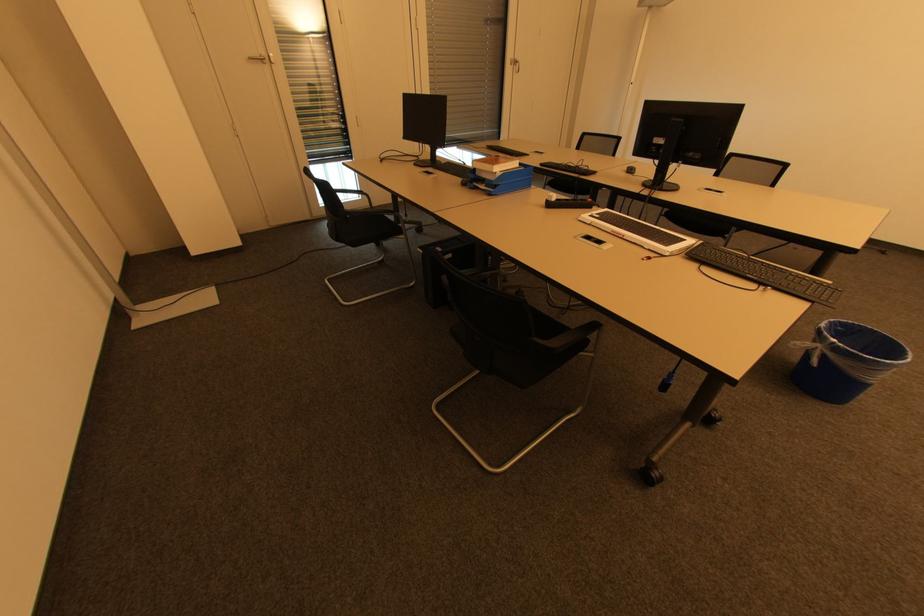
Which object does [495,163] point to?

It corresponds to the orange book in the image.